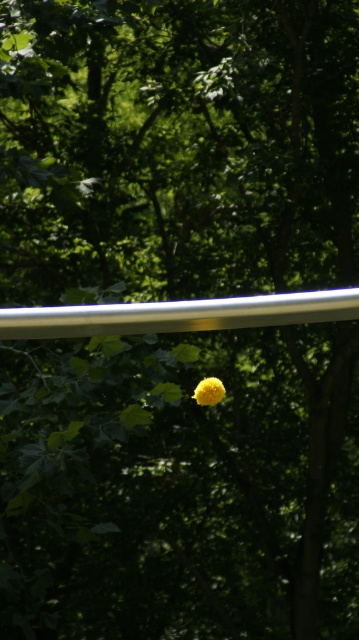
Question: Which point appears farthest from the camera in this image?

Choices:
 (A) (336, 300)
 (B) (198, 397)

Answer: (B)

Question: Can you confirm if silver metallic rail at upper center is positioned to the left of yellow fuzzy ball at center?

Choices:
 (A) no
 (B) yes

Answer: (B)

Question: Where is silver metallic rail at upper center located in relation to yellow fuzzy ball at center in the image?

Choices:
 (A) below
 (B) above

Answer: (B)

Question: Which of the following is the closest to the observer?

Choices:
 (A) yellow fuzzy ball at center
 (B) silver metallic rail at upper center

Answer: (B)

Question: Is silver metallic rail at upper center above yellow fuzzy ball at center?

Choices:
 (A) no
 (B) yes

Answer: (B)